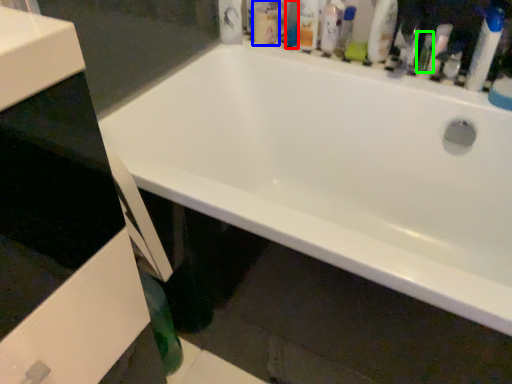
Question: Which is farther away from mouthwash (highlighted by a red box)? mouthwash (highlighted by a blue box) or toiletry (highlighted by a green box)?

Choices:
 (A) mouthwash
 (B) toiletry

Answer: (B)